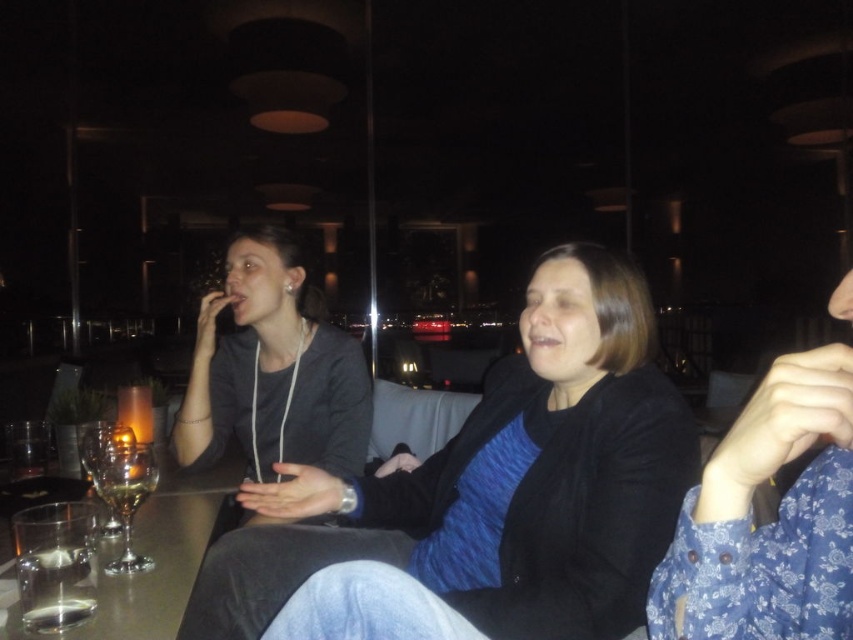
You are a waiter in this restaurant and need to deliver a drink to the person wearing the matte black jacket at center. Which direction should you walk relative to the matte gray hoodie at upper left to reach them?

The matte black jacket at center is below the matte gray hoodie at upper left, so you should walk downward from the matte gray hoodie at upper left to reach the matte black jacket at center.

You are a waiter at this restaurant and need to place a new drink order on the table. The drink must be placed where it won not block the view of the candle. Considering the positions of the matte gray hoodie at upper left and the metallic glass at lower left, which object should you place the drink next to?

You should place the drink next to the metallic glass at lower left because the matte gray hoodie at upper left is much taller and could block the view of the candle if the drink is placed there.

You are standing at the entrance of the restaurant and notice the matte gray hoodie at upper left. Can you determine if the hoodie is closer to the entrance or the back wall based on its position?

The matte gray hoodie at upper left is located at point 0.580 on the x and 0.321 on the y. Since the entrance is typically at the front, which would be lower y coordinates, the hoodie is closer to the entrance.